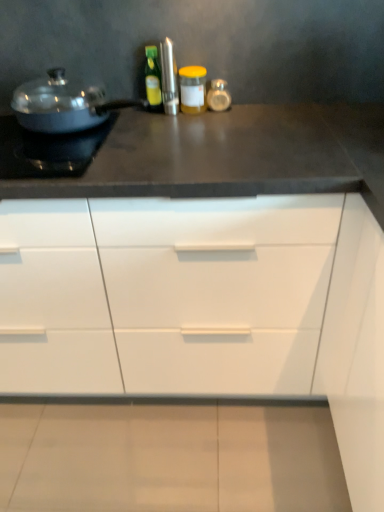
Question: Which direction should I rotate to look at green glass bottle at center, acting as the 1th bottle starting from the left, — up or down?

Choices:
 (A) up
 (B) down

Answer: (A)

Question: From the image's perspective, is white matte cabinet at center beneath green glass bottle at center, acting as the 1th bottle starting from the left?

Choices:
 (A) yes
 (B) no

Answer: (A)

Question: Is white matte cabinet at center to the left of green glass bottle at center, which is the 2th bottle in right-to-left order, from the viewer's perspective?

Choices:
 (A) yes
 (B) no

Answer: (B)

Question: Is white matte cabinet at center in front of green glass bottle at center, which is the 2th bottle in right-to-left order?

Choices:
 (A) no
 (B) yes

Answer: (B)

Question: Is white matte cabinet at center not close to green glass bottle at center, which is the 2th bottle in right-to-left order?

Choices:
 (A) no
 (B) yes

Answer: (A)

Question: Can you confirm if white matte cabinet at center is taller than green glass bottle at center, acting as the 1th bottle starting from the left?

Choices:
 (A) no
 (B) yes

Answer: (B)

Question: Would you say white matte cabinet at center is outside green glass bottle at center, acting as the 1th bottle starting from the left?

Choices:
 (A) no
 (B) yes

Answer: (B)

Question: Does yellow matte jar at center, arranged as the 2th bottle when viewed from the left, appear on the left side of matte black pan at left?

Choices:
 (A) yes
 (B) no

Answer: (B)

Question: From a real-world perspective, is yellow matte jar at center, arranged as the 2th bottle when viewed from the left, physically above matte black pan at left?

Choices:
 (A) yes
 (B) no

Answer: (A)

Question: Is yellow matte jar at center, arranged as the 2th bottle when viewed from the left, completely or partially outside of matte black pan at left?

Choices:
 (A) no
 (B) yes

Answer: (B)

Question: Is yellow matte jar at center, which ranks as the first bottle in right-to-left order, facing towards matte black pan at left?

Choices:
 (A) no
 (B) yes

Answer: (A)

Question: From the image's perspective, is yellow matte jar at center, arranged as the 2th bottle when viewed from the left, over matte black pan at left?

Choices:
 (A) yes
 (B) no

Answer: (A)

Question: Are yellow matte jar at center, arranged as the 2th bottle when viewed from the left, and matte black pan at left located far from each other?

Choices:
 (A) no
 (B) yes

Answer: (A)

Question: Is yellow matte jar at center, arranged as the 2th bottle when viewed from the left, smaller than shiny metallic pot at left?

Choices:
 (A) yes
 (B) no

Answer: (A)